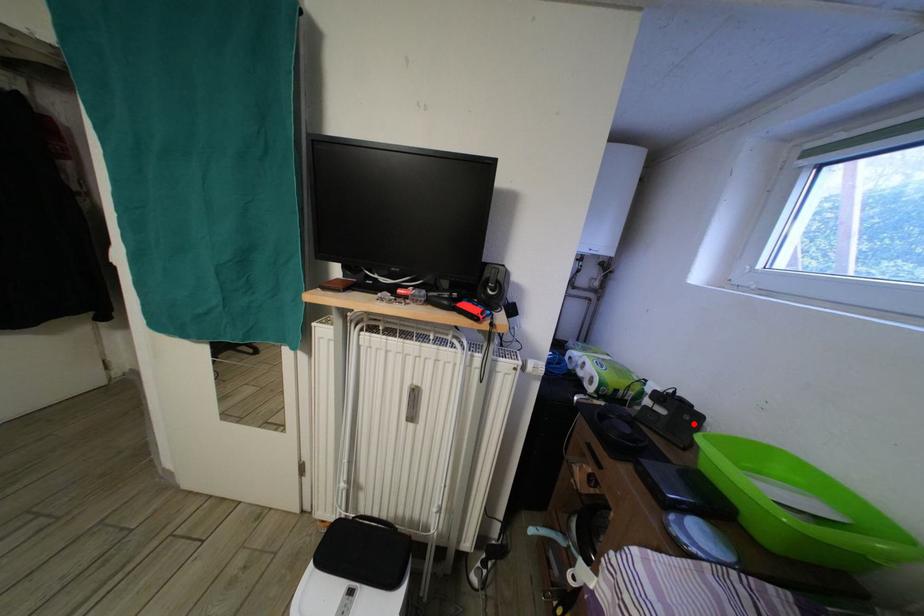
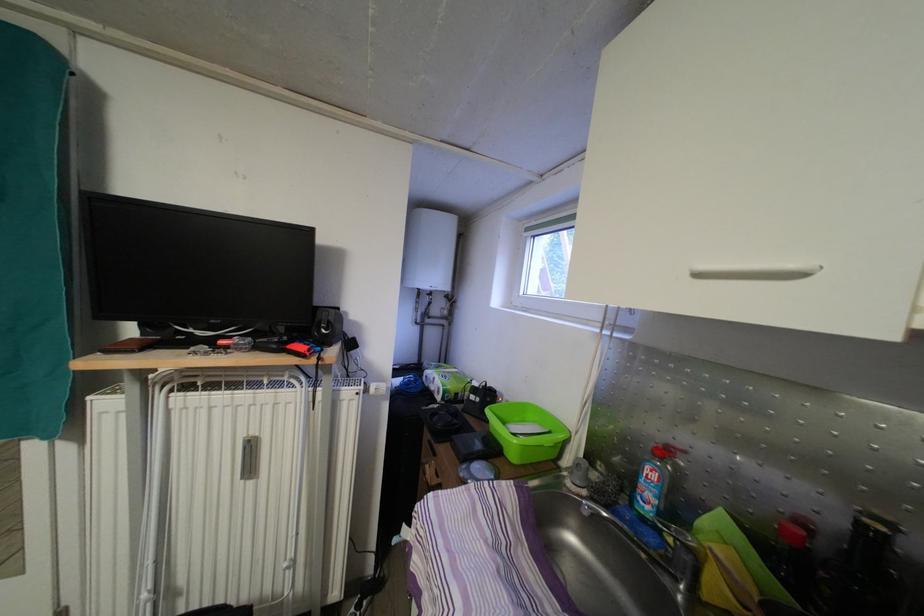
In the second image, find the point that corresponds to the highlighted location in the first image.

(495, 406)